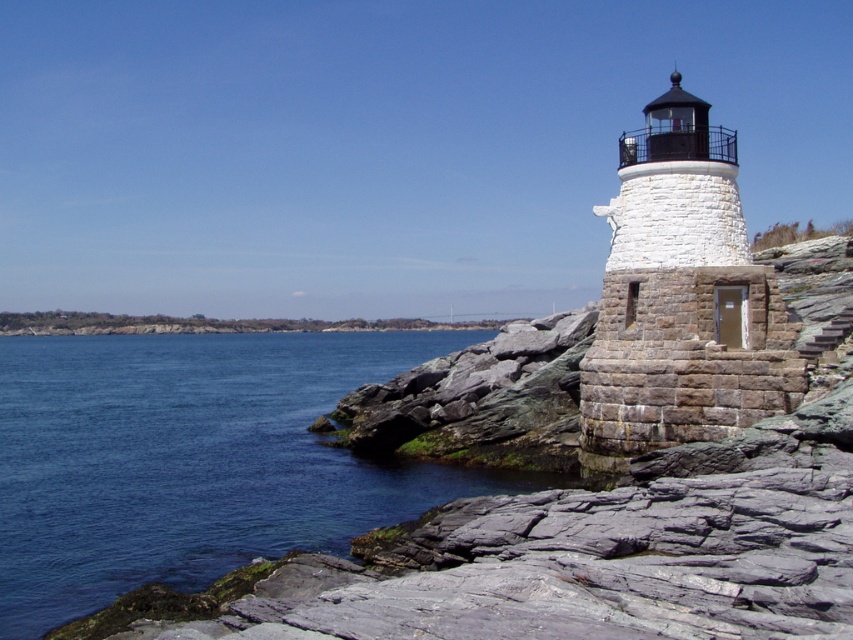
You are standing on the rocky shore looking towards the lighthouse and the stairs. Which object is closer to you, the white stone lighthouse at right or the gray stone stairs at right?

The gray stone stairs at right are closer to you because the white stone lighthouse at right is further away.

You are a tourist standing at the base of the gray stone stairs at right, looking up towards the white stone lighthouse at right. Which direction should you go to reach the lighthouse?

The white stone lighthouse at right is positioned over the gray stone stairs at right, so you should go up the gray stone stairs at right to reach the lighthouse.